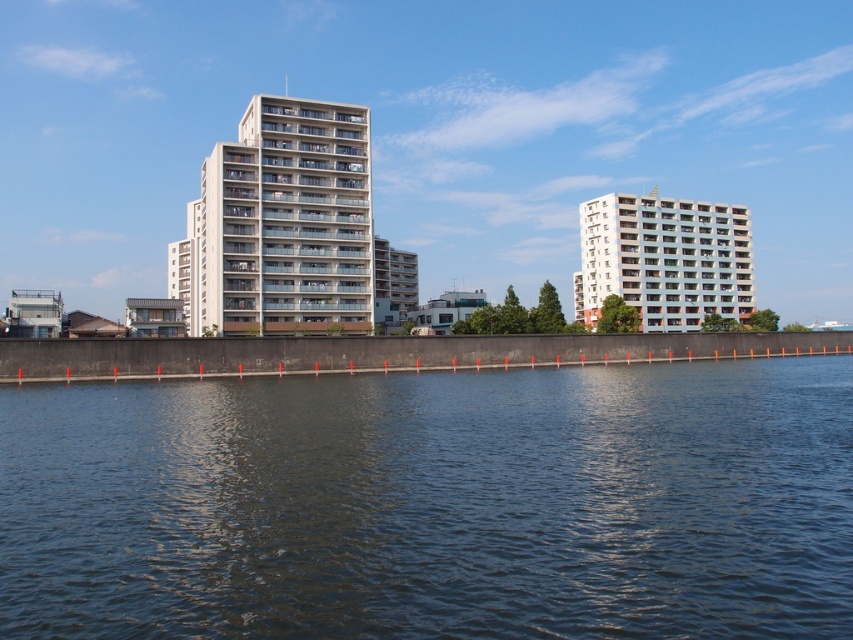
Question: Among these points, which one is nearest to the camera?

Choices:
 (A) (631, 298)
 (B) (186, 257)
 (C) (614, 400)

Answer: (C)

Question: Is dark blue water at center below white concrete building at center?

Choices:
 (A) yes
 (B) no

Answer: (A)

Question: Among these objects, which one is farthest from the camera?

Choices:
 (A) white smooth building at right
 (B) dark blue water at center

Answer: (A)

Question: Is the position of dark blue water at center more distant than that of white smooth building at right?

Choices:
 (A) yes
 (B) no

Answer: (B)

Question: Which object is positioned farthest from the white smooth building at right?

Choices:
 (A) dark blue water at center
 (B) white concrete building at center

Answer: (A)

Question: Does dark blue water at center have a smaller size compared to white concrete building at center?

Choices:
 (A) no
 (B) yes

Answer: (B)